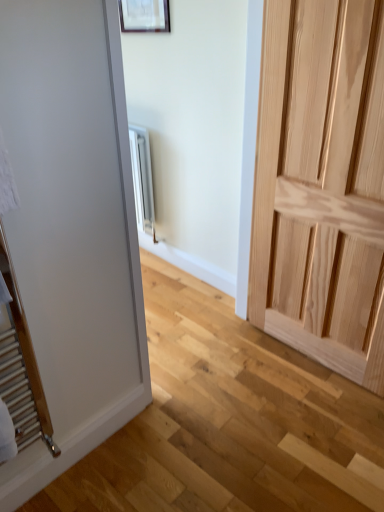
Locate an element on the screen. Image resolution: width=384 pixels, height=512 pixels. free spot below natural wood door at right (from a real-world perspective) is located at coordinates (309, 362).